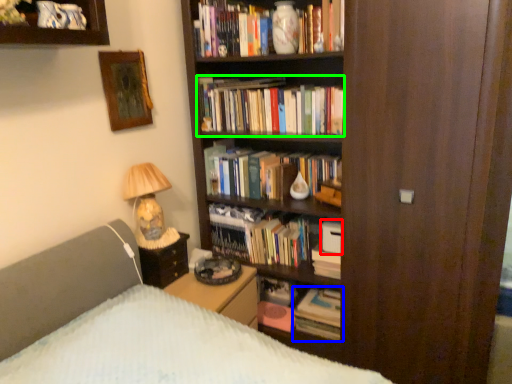
Question: Considering the real-world distances, which object is farthest from paperback book (highlighted by a red box)? book (highlighted by a blue box) or book (highlighted by a green box)?

Choices:
 (A) book
 (B) book

Answer: (B)